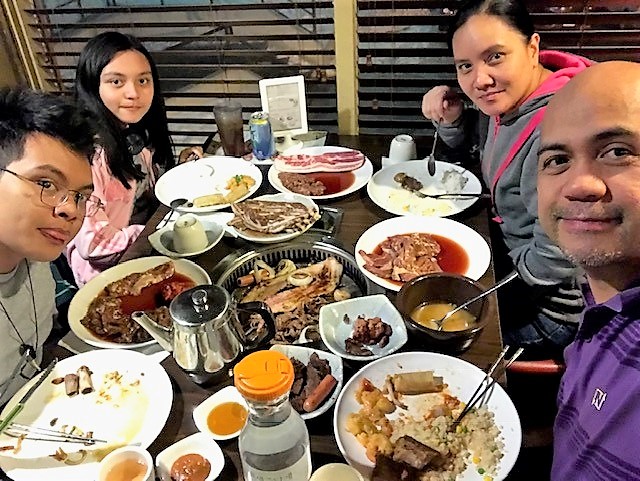
Locate an element on the screen. The height and width of the screenshot is (481, 640). pitcher is located at coordinates (265, 419).